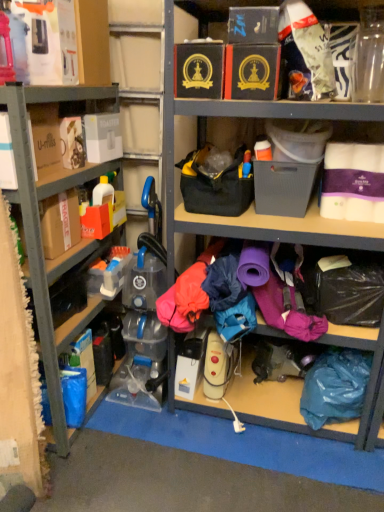
Question: Which direction should I rotate to look at black cardboard box at upper center, placed as the 3th storage box when sorted from left to right, — up or down?

Choices:
 (A) down
 (B) up

Answer: (B)

Question: From a real-world perspective, is black cardboard box at upper center, placed as the 3th storage box when sorted from left to right, under teal fabric bag at lower right?

Choices:
 (A) no
 (B) yes

Answer: (A)

Question: Considering the relative sizes of black cardboard box at upper center, placed as the 3th storage box when sorted from left to right, and teal fabric bag at lower right in the image provided, is black cardboard box at upper center, placed as the 3th storage box when sorted from left to right, shorter than teal fabric bag at lower right?

Choices:
 (A) no
 (B) yes

Answer: (B)

Question: Can we say black cardboard box at upper center, arranged as the 3th storage box when viewed from the right, lies outside teal fabric bag at lower right?

Choices:
 (A) no
 (B) yes

Answer: (B)

Question: From the image's perspective, is black cardboard box at upper center, placed as the 3th storage box when sorted from left to right, on teal fabric bag at lower right?

Choices:
 (A) no
 (B) yes

Answer: (B)

Question: Is teal fabric bag at lower right completely or partially inside black cardboard box at upper center, placed as the 3th storage box when sorted from left to right?

Choices:
 (A) yes
 (B) no

Answer: (B)

Question: Is black cardboard box at upper center, placed as the 3th storage box when sorted from left to right, behind teal fabric bag at lower right?

Choices:
 (A) yes
 (B) no

Answer: (B)

Question: Is matte black box at upper center, marked as the 4th storage box in a left-to-right arrangement, shorter than gray plastic storage box at center, the 5th storage box when ordered from left to right?

Choices:
 (A) no
 (B) yes

Answer: (B)

Question: Does matte black box at upper center, which appears as the 2th storage box when viewed from the right, have a smaller size compared to gray plastic storage box at center, which is counted as the first storage box, starting from the right?

Choices:
 (A) no
 (B) yes

Answer: (B)

Question: Is matte black box at upper center, marked as the 4th storage box in a left-to-right arrangement, bigger than gray plastic storage box at center, which is counted as the first storage box, starting from the right?

Choices:
 (A) yes
 (B) no

Answer: (B)

Question: Is matte black box at upper center, which appears as the 2th storage box when viewed from the right, aimed at gray plastic storage box at center, the 5th storage box when ordered from left to right?

Choices:
 (A) yes
 (B) no

Answer: (B)

Question: From the image's perspective, would you say matte black box at upper center, which appears as the 2th storage box when viewed from the right, is positioned over gray plastic storage box at center, which is counted as the first storage box, starting from the right?

Choices:
 (A) yes
 (B) no

Answer: (A)

Question: Is matte black box at upper center, which appears as the 2th storage box when viewed from the right, thinner than gray plastic storage box at center, the 5th storage box when ordered from left to right?

Choices:
 (A) no
 (B) yes

Answer: (A)

Question: Considering the relative sizes of teal fabric bag at lower right and matte black box at upper center, marked as the 4th storage box in a left-to-right arrangement, in the image provided, is teal fabric bag at lower right bigger than matte black box at upper center, marked as the 4th storage box in a left-to-right arrangement,?

Choices:
 (A) yes
 (B) no

Answer: (A)